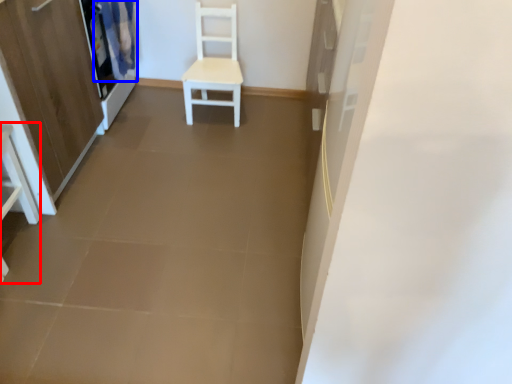
Question: Which object appears farthest to the camera in this image, vanity (highlighted by a red box) or curtain (highlighted by a blue box)?

Choices:
 (A) vanity
 (B) curtain

Answer: (B)